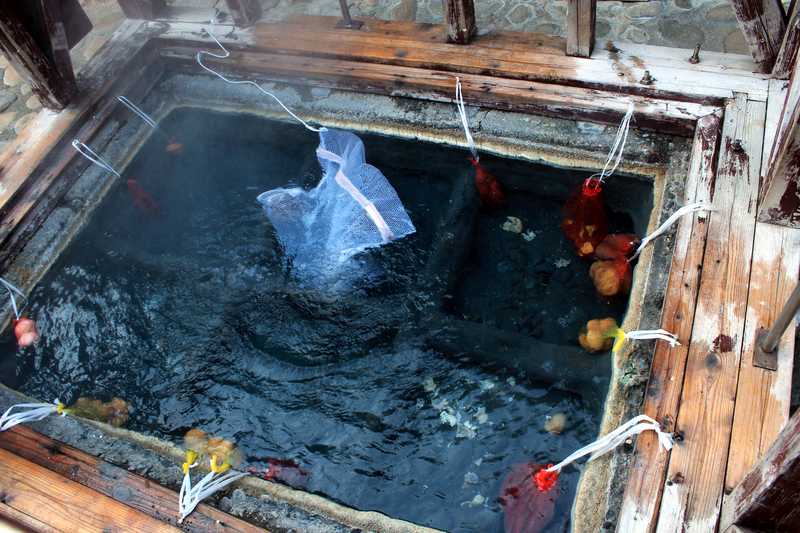
Find the location of a particular element. Image resolution: width=800 pixels, height=533 pixels. paint is located at coordinates (710, 91).